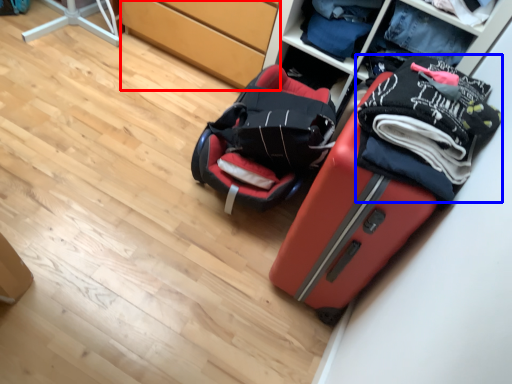
Question: Among these objects, which one is nearest to the camera, cabinetry (highlighted by a red box) or clothing (highlighted by a blue box)?

Choices:
 (A) cabinetry
 (B) clothing

Answer: (B)